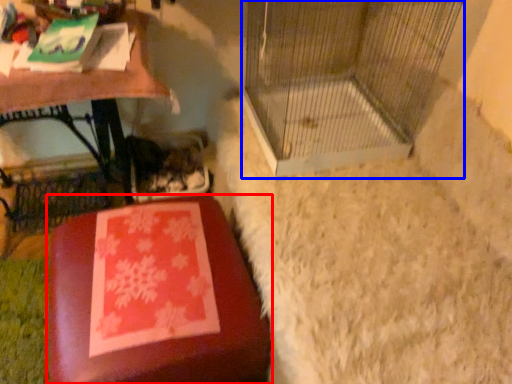
Question: Which of the following is the closest to the observer, furniture (highlighted by a red box) or bird cage (highlighted by a blue box)?

Choices:
 (A) furniture
 (B) bird cage

Answer: (A)